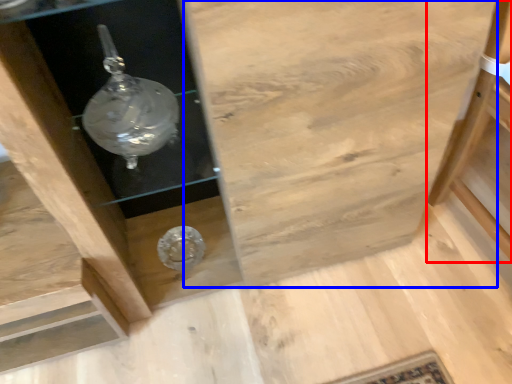
Question: Which object is further to the camera taking this photo, furniture (highlighted by a red box) or cabinetry (highlighted by a blue box)?

Choices:
 (A) furniture
 (B) cabinetry

Answer: (A)